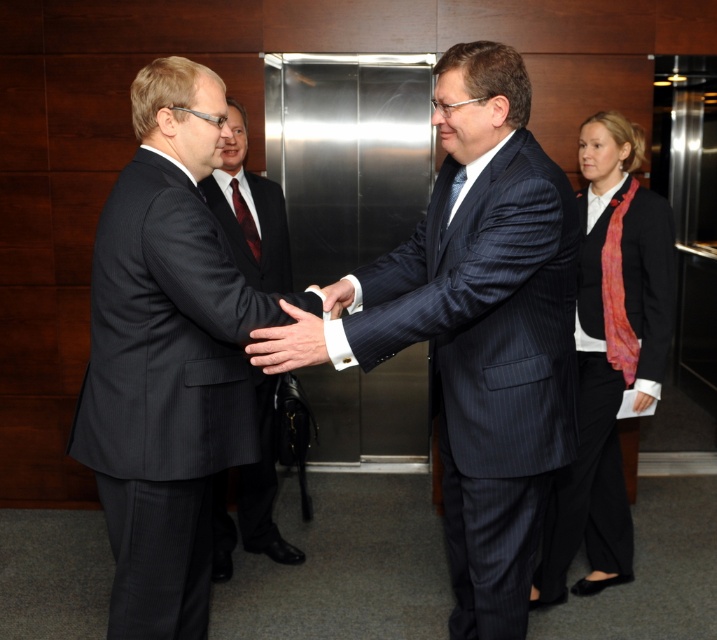
Question: Which object is farther from the camera taking this photo?

Choices:
 (A) white smooth hand at center
 (B) pinstriped wool suit at center
 (C) white glossy cufflink at center
 (D) shiny red tie at center

Answer: (D)

Question: Which of the following is the closest to the observer?

Choices:
 (A) dark blue pinstripe suit at center
 (B) pinstriped wool suit at center
 (C) dark gray pinstripe suit at center
 (D) white glossy cufflink at center

Answer: (A)

Question: Is dark gray pinstripe suit at center thinner than dark blue silk tie at center?

Choices:
 (A) yes
 (B) no

Answer: (B)

Question: Can you confirm if pinstriped wool suit at center is positioned to the left of shiny red tie at center?

Choices:
 (A) yes
 (B) no

Answer: (B)

Question: Is the position of dark blue pinstripe suit at center more distant than that of white glossy cufflink at center?

Choices:
 (A) no
 (B) yes

Answer: (A)

Question: Estimate the real-world distances between objects in this image. Which object is farther from the dark blue silk tie at center?

Choices:
 (A) white glossy cufflink at center
 (B) shiny red tie at center
 (C) white smooth hand at center

Answer: (B)